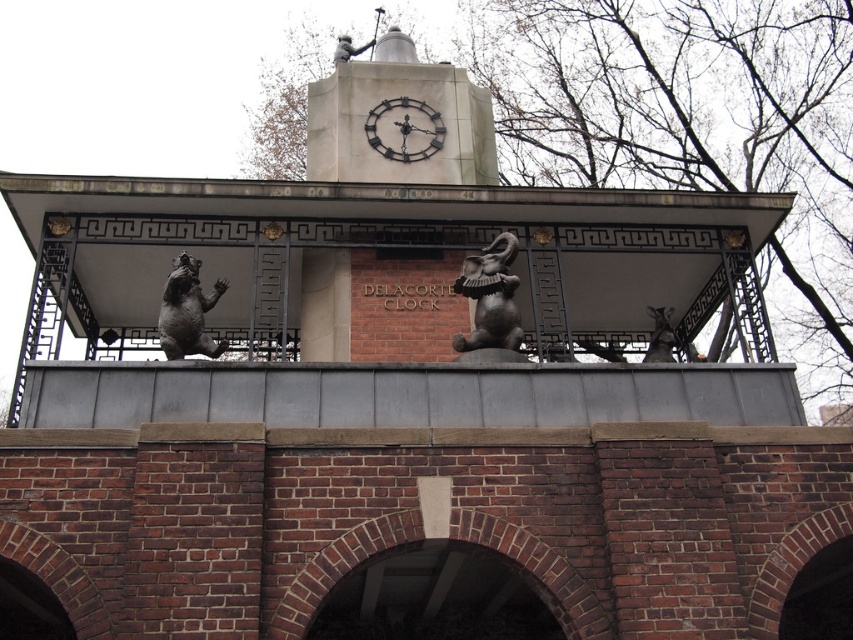
Question: Which object is closer to the camera taking this photo?

Choices:
 (A) shiny bronze elephant at center
 (B) shiny bronze bear at upper left
 (C) metallic clock at center

Answer: (B)

Question: Which of the following is the farthest from the observer?

Choices:
 (A) (374, 109)
 (B) (183, 339)
 (C) (505, 236)

Answer: (A)

Question: Observing the image, what is the correct spatial positioning of shiny bronze elephant at center in reference to shiny bronze bear at upper left?

Choices:
 (A) left
 (B) right

Answer: (B)

Question: Which point appears farthest from the camera in this image?

Choices:
 (A) (369, 120)
 (B) (177, 349)

Answer: (A)

Question: Can you confirm if shiny bronze elephant at center is positioned below metallic clock at center?

Choices:
 (A) no
 (B) yes

Answer: (B)

Question: Is shiny bronze bear at upper left further to the viewer compared to metallic clock at center?

Choices:
 (A) no
 (B) yes

Answer: (A)